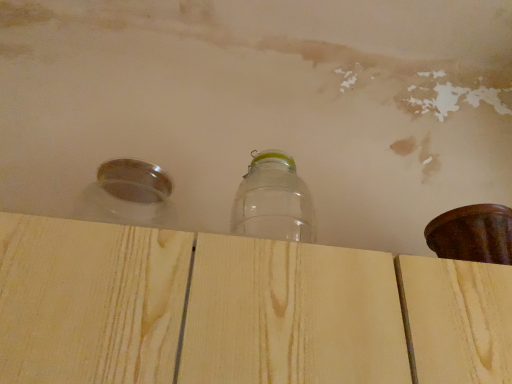
In the scene shown: In order to face transparent glass jar at center, should I rotate leftwards or rightwards?

Turn right approximately 2.638 degrees to face it.

The height and width of the screenshot is (384, 512). I want to click on transparent glass jar at center, so click(x=273, y=201).

What do you see at coordinates (273, 201) in the screenshot? I see `transparent glass jar at center` at bounding box center [273, 201].

What are the coordinates of `transparent glass jar at center` in the screenshot? It's located at (273, 201).